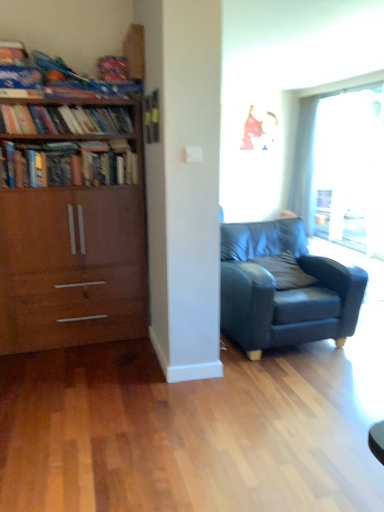
Where is `free space in front of matte black armchair at center`? free space in front of matte black armchair at center is located at coordinates (285, 400).